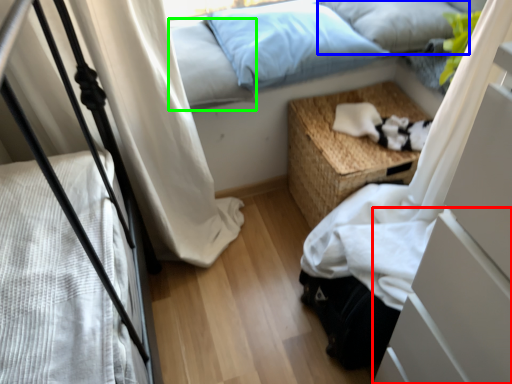
Question: Which is nearer to the drawer (highlighted by a red box)? pillow (highlighted by a blue box) or pillow (highlighted by a green box).

Choices:
 (A) pillow
 (B) pillow

Answer: (B)